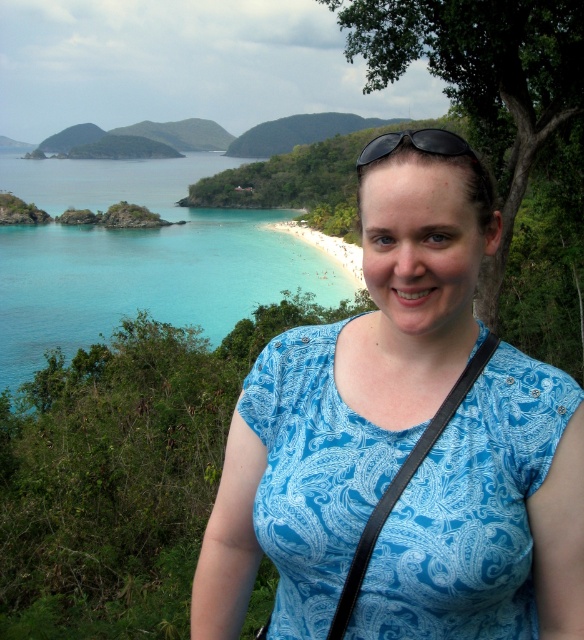
You are a photographer trying to capture the black plastic sunglasses at upper center and the turquoise water at upper left in the same frame. Which object should you adjust your camera to focus on first if you want to include both in your shot?

You should focus on the black plastic sunglasses at upper center first because the turquoise water at upper left is positioned on the left side of it, so adjusting the frame to include the sunglasses will naturally incorporate the water as well.